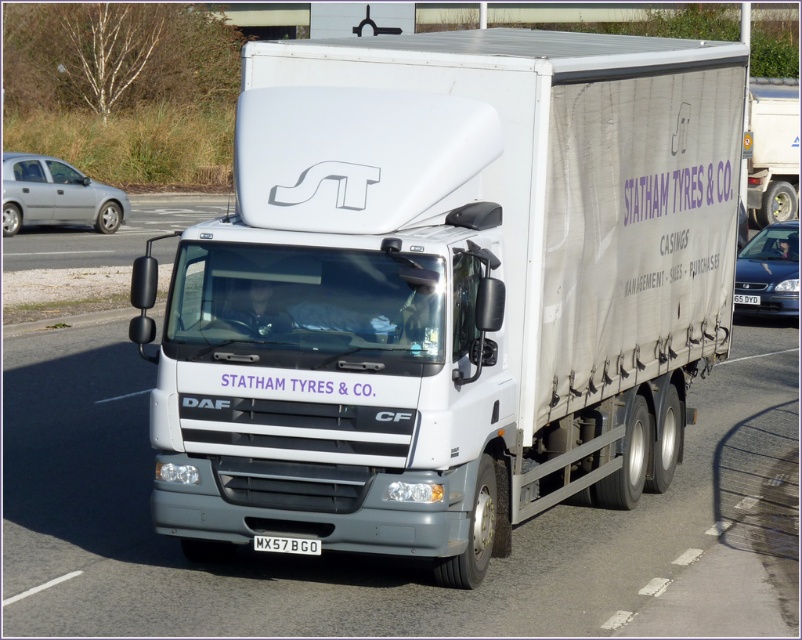
Who is higher up, silver metallic sedan at left or metallic blue sedan at right?

silver metallic sedan at left

Does silver metallic sedan at left have a lesser height compared to metallic blue sedan at right?

No, silver metallic sedan at left is not shorter than metallic blue sedan at right.

I want to click on silver metallic sedan at left, so click(x=55, y=195).

In order to click on silver metallic sedan at left in this screenshot , I will do `click(55, 195)`.

Does white matte trailer truck at center have a greater height compared to silver metallic sedan at left?

Incorrect, white matte trailer truck at center's height is not larger of silver metallic sedan at left's.

Does white matte trailer truck at center have a lesser height compared to silver metallic sedan at left?

Yes, white matte trailer truck at center is shorter than silver metallic sedan at left.

Which is in front, point (559, 424) or point (63, 193)?

Positioned in front is point (559, 424).

I want to click on white matte trailer truck at center, so click(448, 289).

Based on the photo, is white matte trailer truck at center shorter than metallic blue sedan at right?

No, white matte trailer truck at center is not shorter than metallic blue sedan at right.

Is point (310, 481) behind point (744, 244)?

No, it is not.

The width and height of the screenshot is (802, 640). What do you see at coordinates (448, 289) in the screenshot?
I see `white matte trailer truck at center` at bounding box center [448, 289].

Locate an element on the screen. white matte trailer truck at center is located at coordinates (448, 289).